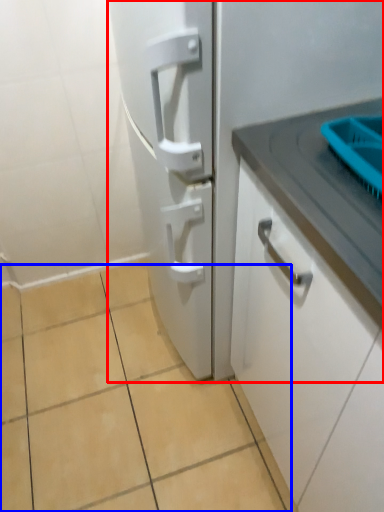
Question: Among these objects, which one is nearest to the camera, refrigerator (highlighted by a red box) or ceramic tile (highlighted by a blue box)?

Choices:
 (A) refrigerator
 (B) ceramic tile

Answer: (A)